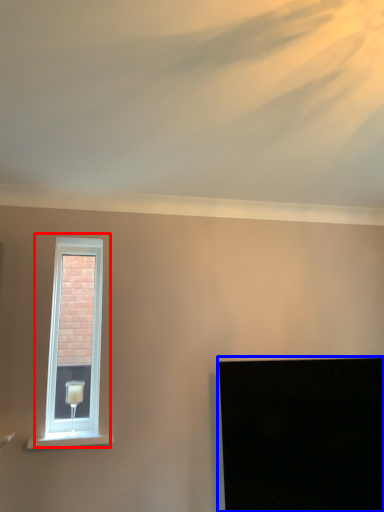
Question: Which point is further to the camera, window (highlighted by a red box) or computer screen (highlighted by a blue box)?

Choices:
 (A) window
 (B) computer screen

Answer: (A)